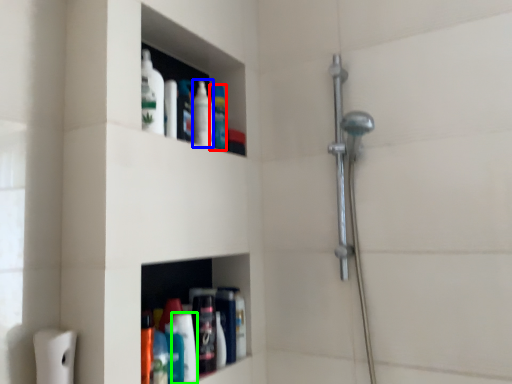
Question: Considering the real-world distances, which object is closest to cleaning product (highlighted by a red box)? mouthwash (highlighted by a blue box) or cleaning product (highlighted by a green box).

Choices:
 (A) mouthwash
 (B) cleaning product

Answer: (A)